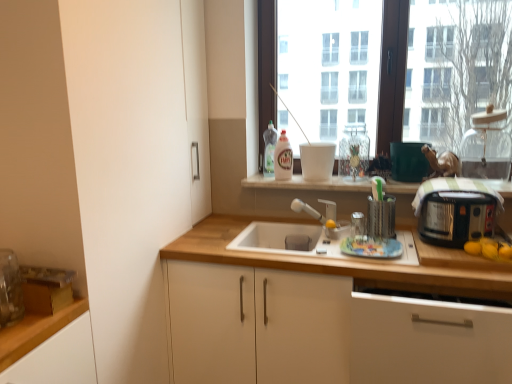
Question: Does white matte cabinet at center, marked as the second cabinetry in a right-to-left arrangement, have a smaller size compared to translucent plastic bottle at upper center, the second bottle from the front?

Choices:
 (A) no
 (B) yes

Answer: (A)

Question: Is white matte cabinet at center, the first cabinetry positioned from the left, bigger than translucent plastic bottle at upper center, the second bottle from the front?

Choices:
 (A) no
 (B) yes

Answer: (B)

Question: Considering the relative sizes of white matte cabinet at center, marked as the second cabinetry in a right-to-left arrangement, and translucent plastic bottle at upper center, the second bottle from the front, in the image provided, is white matte cabinet at center, marked as the second cabinetry in a right-to-left arrangement, thinner than translucent plastic bottle at upper center, the second bottle from the front,?

Choices:
 (A) yes
 (B) no

Answer: (B)

Question: Does white matte cabinet at center, the first cabinetry positioned from the left, lie behind translucent plastic bottle at upper center, arranged as the 1th bottle when viewed from the back?

Choices:
 (A) yes
 (B) no

Answer: (B)

Question: Is white matte cabinet at center, the first cabinetry positioned from the left, in front of translucent plastic bottle at upper center, the second bottle from the front?

Choices:
 (A) no
 (B) yes

Answer: (B)

Question: Considering the relative sizes of white matte cabinet at center, the first cabinetry positioned from the left, and translucent plastic bottle at upper center, arranged as the 1th bottle when viewed from the back, in the image provided, is white matte cabinet at center, the first cabinetry positioned from the left, shorter than translucent plastic bottle at upper center, arranged as the 1th bottle when viewed from the back,?

Choices:
 (A) yes
 (B) no

Answer: (B)

Question: Is green matte pot at upper right, which is the 3th appliance from left to right, shorter than transparent glass jar at upper right, arranged as the first appliance when viewed from the right?

Choices:
 (A) no
 (B) yes

Answer: (B)

Question: Is green matte pot at upper right, marked as the 3th appliance in a right-to-left arrangement, thinner than transparent glass jar at upper right, which is counted as the 5th appliance, starting from the left?

Choices:
 (A) no
 (B) yes

Answer: (B)

Question: Would you say green matte pot at upper right, marked as the 3th appliance in a right-to-left arrangement, is outside transparent glass jar at upper right, arranged as the first appliance when viewed from the right?

Choices:
 (A) no
 (B) yes

Answer: (B)

Question: From the image's perspective, is green matte pot at upper right, marked as the 3th appliance in a right-to-left arrangement, beneath transparent glass jar at upper right, arranged as the first appliance when viewed from the right?

Choices:
 (A) yes
 (B) no

Answer: (A)

Question: Can you confirm if green matte pot at upper right, which is the 3th appliance from left to right, is smaller than transparent glass jar at upper right, arranged as the first appliance when viewed from the right?

Choices:
 (A) no
 (B) yes

Answer: (B)

Question: Does green matte pot at upper right, which is the 3th appliance from left to right, come behind transparent glass jar at upper right, arranged as the first appliance when viewed from the right?

Choices:
 (A) no
 (B) yes

Answer: (B)

Question: Considering the relative sizes of white matte bowl at upper center, which is counted as the fifth appliance, starting from the right, and matte silver faucet at center in the image provided, is white matte bowl at upper center, which is counted as the fifth appliance, starting from the right, smaller than matte silver faucet at center?

Choices:
 (A) yes
 (B) no

Answer: (A)